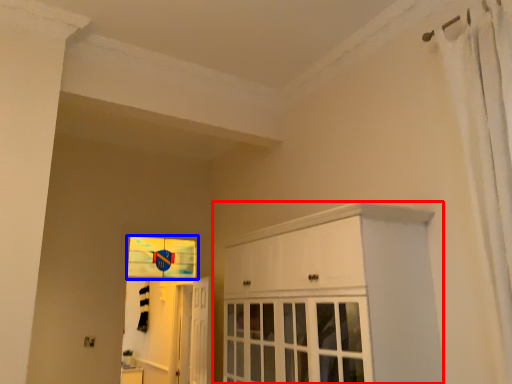
Question: Among these objects, which one is farthest to the camera, cabinetry (highlighted by a red box) or window (highlighted by a blue box)?

Choices:
 (A) cabinetry
 (B) window

Answer: (B)